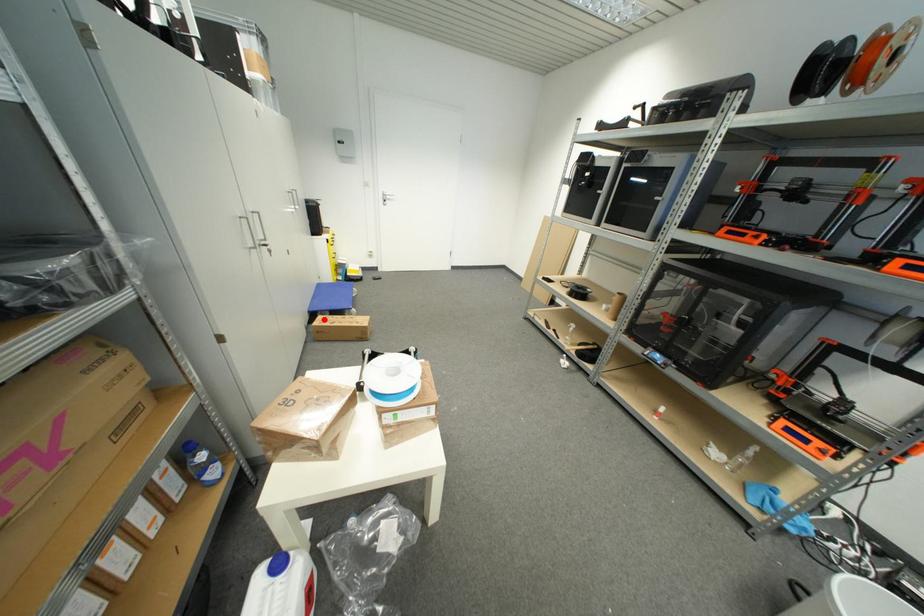
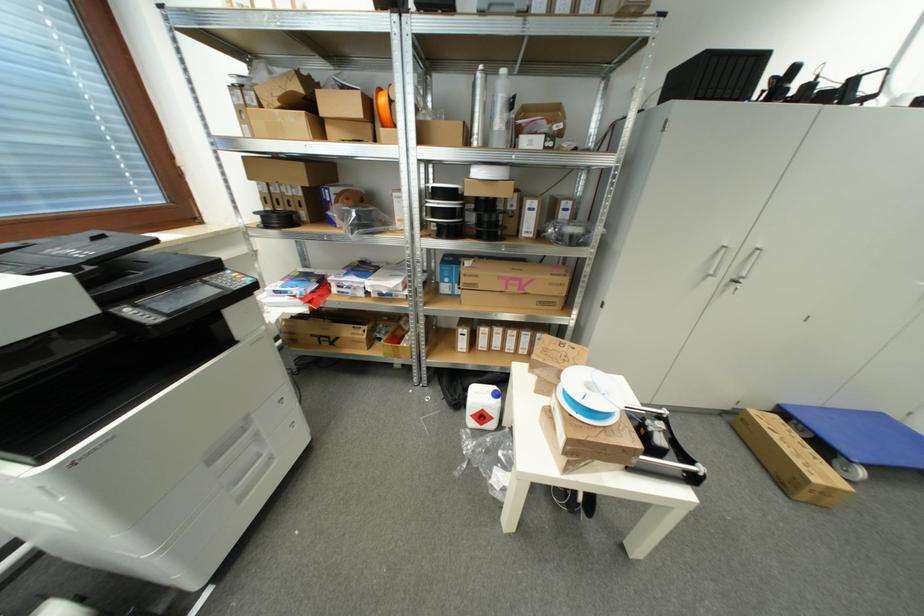
Question: I am providing you with two images of the same scene from different viewpoints. In image1, a red point is highlighted. Considering the same 3D point in image2, which of the following is correct?

Choices:
 (A) It is closer
 (B) It is farther

Answer: (A)